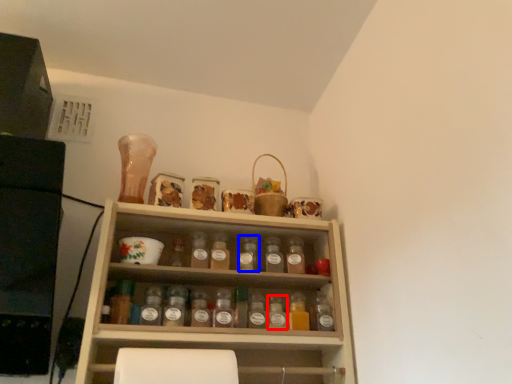
Question: Which of the following is the closest to the observer, bottle (highlighted by a red box) or bottle (highlighted by a blue box)?

Choices:
 (A) bottle
 (B) bottle

Answer: (A)